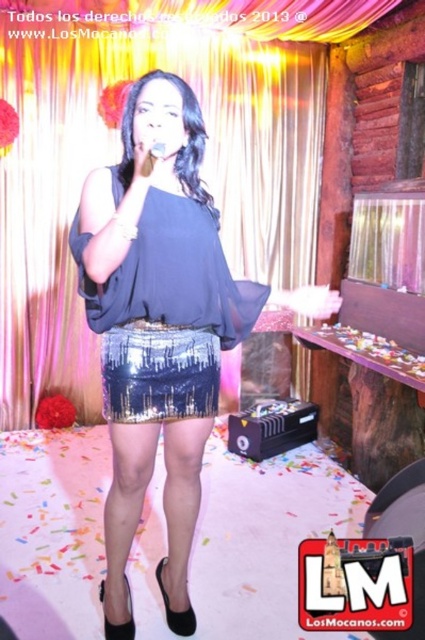
You are an event planner setting up a camera to capture the stage. The camera needs to be positioned to focus on the metallic gold curtain at upper center. What is the exact coordinate where you should aim the camera?

The metallic gold curtain at upper center is located at point (119, 160), so you should aim the camera at those coordinates to focus on it.

You are a photographer at the event and want to take a closeup shot of both the shiny sequined skirt at center and the sparkly sequined skirt at center. However, you can only focus on one of them clearly. Which one will appear in focus if you focus on the one closer to the camera?

The shiny sequined skirt at center will appear in focus because it is closer to the camera than the sparkly sequined skirt at center.

You are an event planner organizing a surprise party. You need to decide whether the metallic gold curtain at upper center can completely cover the matte blue blouse at center if placed directly in front of it. Based on their sizes, what would you advise?

The metallic gold curtain at upper center has a larger size compared to the matte blue blouse at center, so it can completely cover the matte blue blouse at center when placed in front.